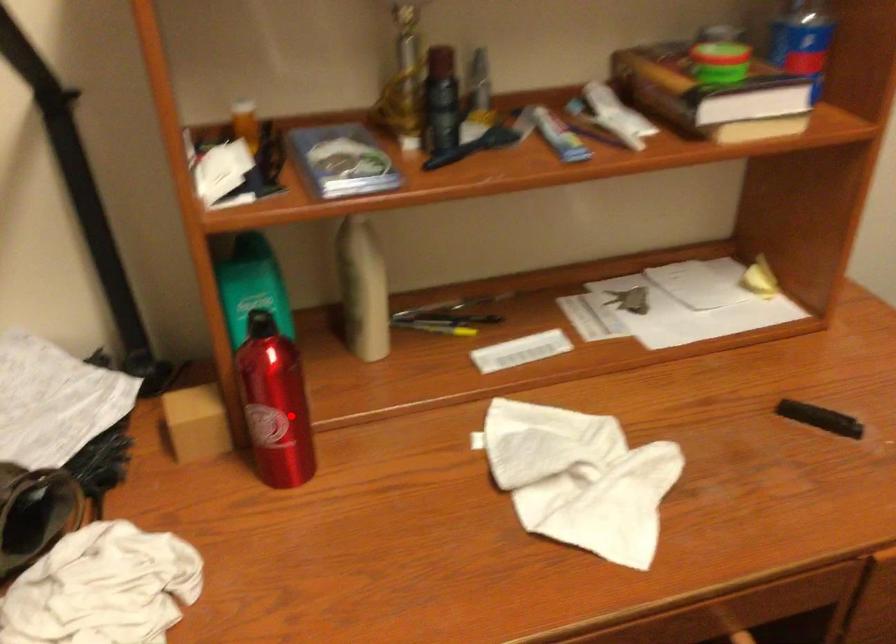
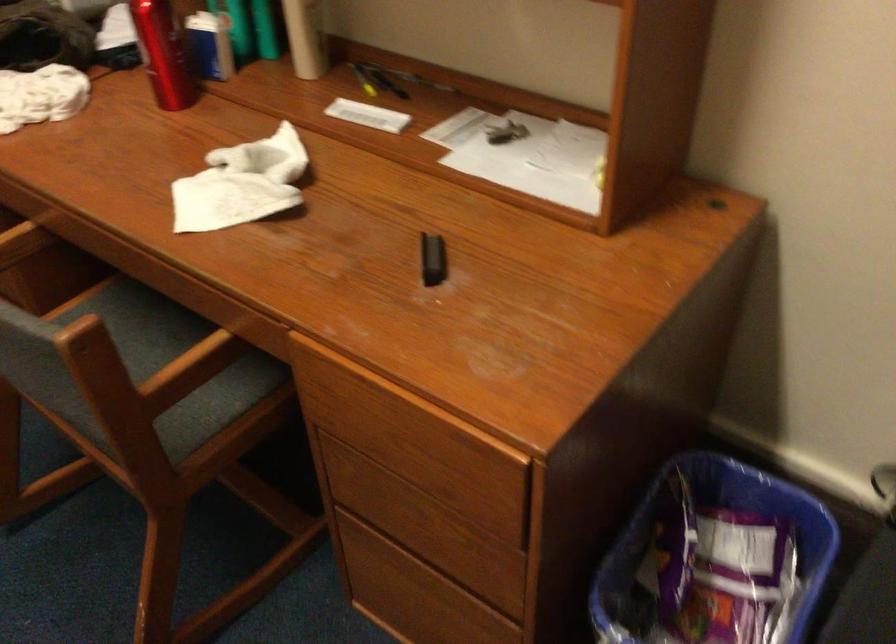
Question: I am providing you with two images of the same scene from different viewpoints. A red point is shown in image1. For the corresponding object point in image2, is it positioned nearer or farther from the camera?

Choices:
 (A) Nearer
 (B) Farther

Answer: (B)